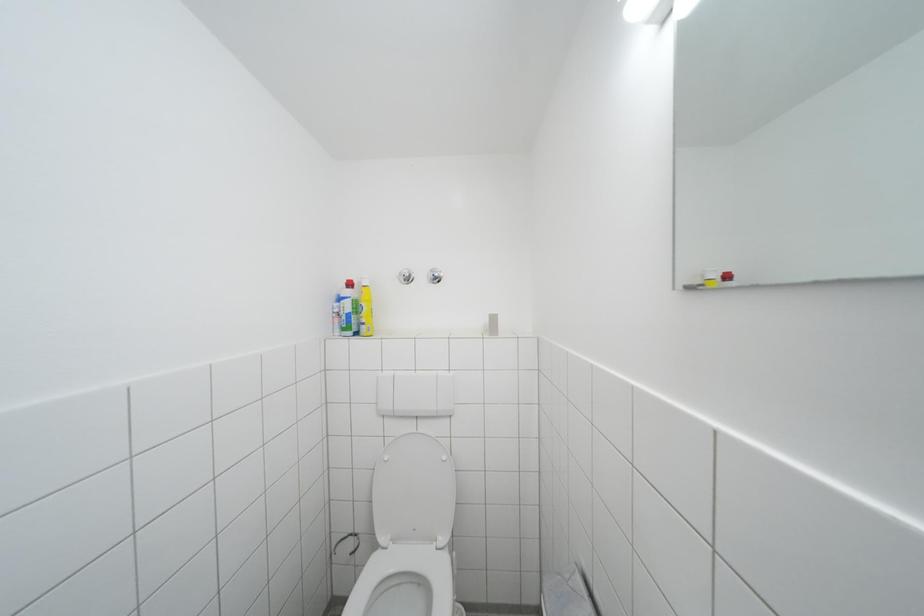
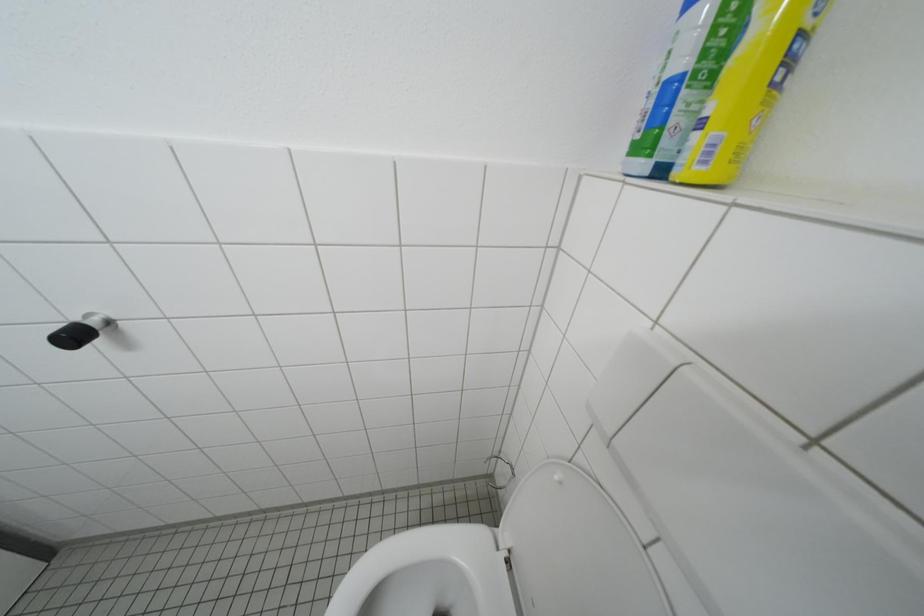
How did the camera likely rotate?

The camera rotated toward left-down.